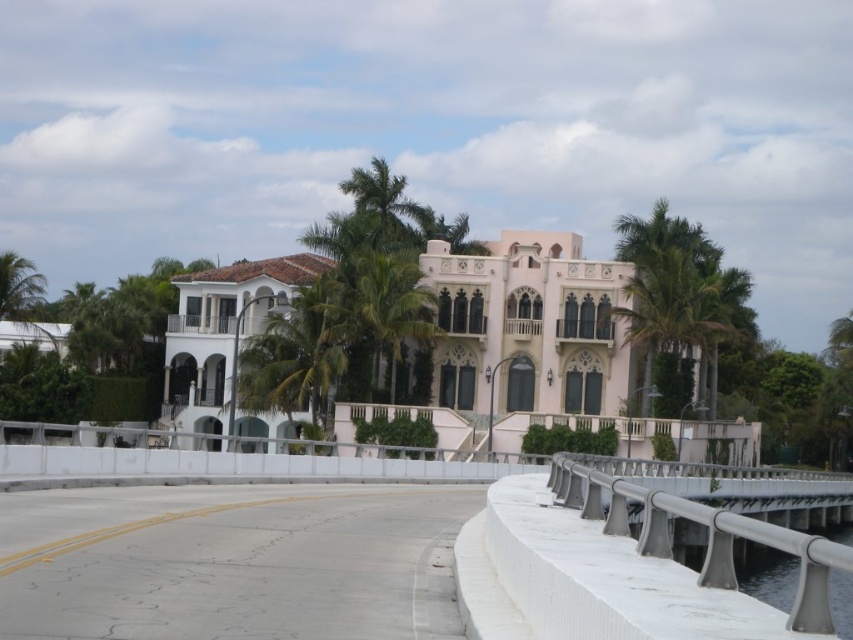
Question: Can you confirm if pink stucco mansion at center is wider than green leafy palm tree at center?

Choices:
 (A) no
 (B) yes

Answer: (B)

Question: From the image, what is the correct spatial relationship of pink stucco mansion at center in relation to green leafy palm tree at center?

Choices:
 (A) left
 (B) right

Answer: (B)

Question: Which of the following is the farthest from the observer?

Choices:
 (A) (341, 364)
 (B) (459, 362)

Answer: (B)

Question: Does pink stucco mansion at center have a greater width compared to green leafy palm tree at center?

Choices:
 (A) no
 (B) yes

Answer: (B)

Question: Among these points, which one is nearest to the camera?

Choices:
 (A) (234, 433)
 (B) (267, 339)

Answer: (B)